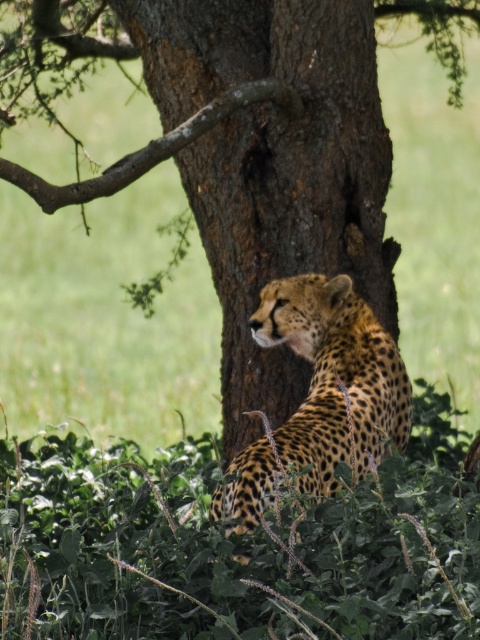
Question: Can you confirm if brown rough tree trunk at center is positioned to the left of spotted fur cheetah at center?

Choices:
 (A) no
 (B) yes

Answer: (B)

Question: Is brown rough tree trunk at center positioned behind spotted fur cheetah at center?

Choices:
 (A) no
 (B) yes

Answer: (B)

Question: Which of the following is the closest to the observer?

Choices:
 (A) (228, 369)
 (B) (375, 420)

Answer: (B)

Question: Which point appears closest to the camera in this image?

Choices:
 (A) (280, 26)
 (B) (269, 328)

Answer: (B)

Question: Among these points, which one is nearest to the camera?

Choices:
 (A) (264, 326)
 (B) (363, 278)

Answer: (A)

Question: From the image, what is the correct spatial relationship of brown rough tree trunk at center in relation to spotted fur cheetah at center?

Choices:
 (A) below
 (B) above

Answer: (B)